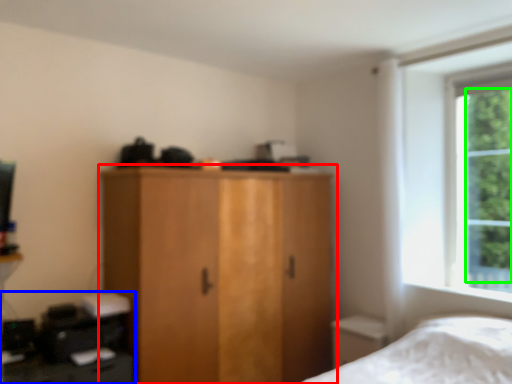
Question: Estimate the real-world distances between objects in this image. Which object is closer to cupboard (highlighted by a red box), computer desk (highlighted by a blue box) or tree (highlighted by a green box)?

Choices:
 (A) computer desk
 (B) tree

Answer: (A)